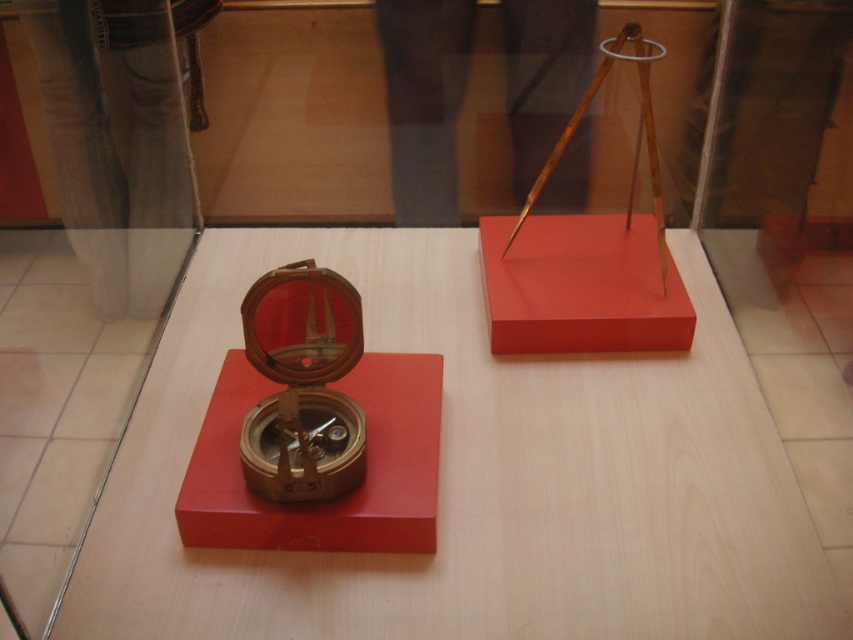
Between brass compass at center and wooden compass at center, which one appears on the right side from the viewer's perspective?

From the viewer's perspective, brass compass at center appears more on the right side.

Image resolution: width=853 pixels, height=640 pixels. Find the location of `brass compass at center`. brass compass at center is located at coordinates (334, 499).

At what (x,y) coordinates should I click in order to perform the action: click on brass compass at center. Please return your answer as a coordinate pair (x, y). Looking at the image, I should click on (334, 499).

Does matte wooden table at center have a larger size compared to brass compass at center?

Indeed, matte wooden table at center has a larger size compared to brass compass at center.

From the picture: Between matte wooden table at center and brass compass at center, which one appears on the left side from the viewer's perspective?

From the viewer's perspective, brass compass at center appears more on the left side.

I want to click on matte wooden table at center, so click(476, 477).

Based on the photo, is matte wooden table at center taller than wooden compass at center?

Yes.

Can you confirm if matte wooden table at center is positioned to the left of wooden compass at center?

Incorrect, matte wooden table at center is not on the left side of wooden compass at center.

Which is in front, point (631, 435) or point (286, 326)?

Point (286, 326)

Find the location of a particular element. Image resolution: width=853 pixels, height=640 pixels. matte wooden table at center is located at coordinates (476, 477).